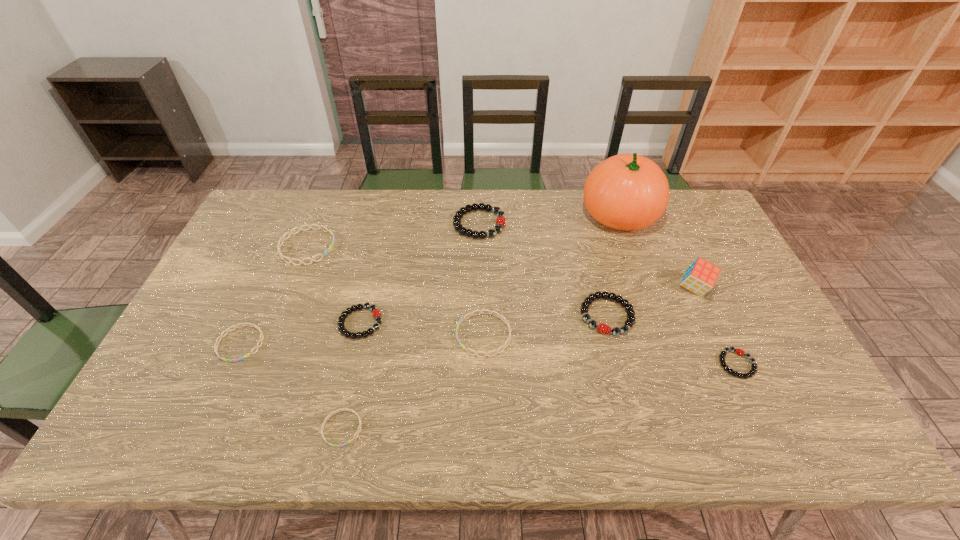
In order to click on the tallest object in this screenshot , I will do `click(627, 192)`.

Locate an element on the screen. the ninth shortest object is located at coordinates (701, 276).

Where is `cube`? The width and height of the screenshot is (960, 540). cube is located at coordinates (701, 276).

Find the location of a particular element. the biggest black bracelet is located at coordinates (501, 220).

The image size is (960, 540). Identify the location of the third tallest object. (501, 220).

I want to click on the biggest blue bracelet, so click(283, 238).

Image resolution: width=960 pixels, height=540 pixels. I want to click on the third smallest black bracelet, so click(x=602, y=328).

This screenshot has height=540, width=960. In order to click on the second bracelet from right to left in this screenshot , I will do `click(602, 328)`.

Where is `the third smallest blue bracelet`? Image resolution: width=960 pixels, height=540 pixels. the third smallest blue bracelet is located at coordinates (506, 322).

Where is `the third biggest black bracelet`? the third biggest black bracelet is located at coordinates (376, 314).